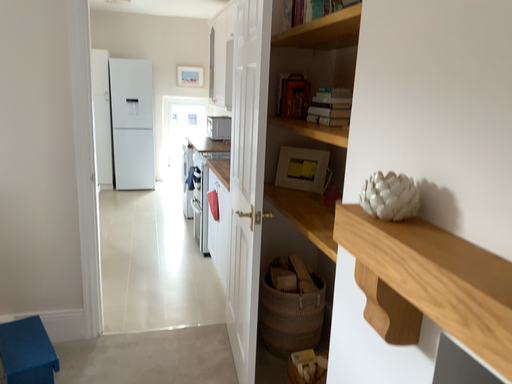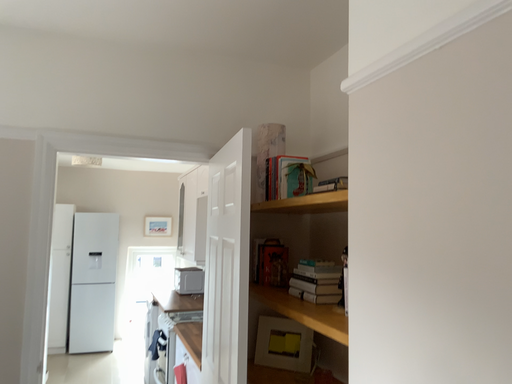
Question: Which way did the camera rotate in the video?

Choices:
 (A) rotated downward
 (B) rotated upward

Answer: (B)